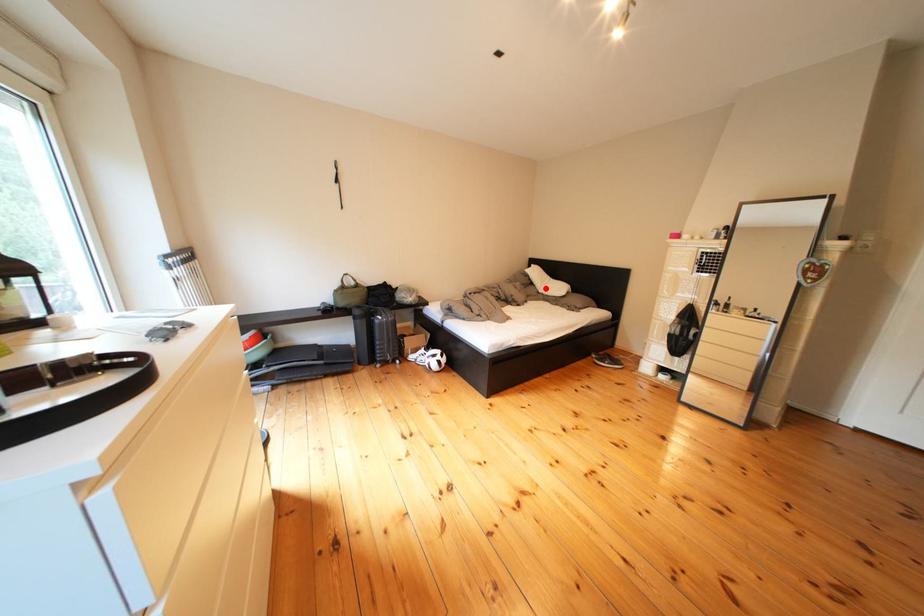
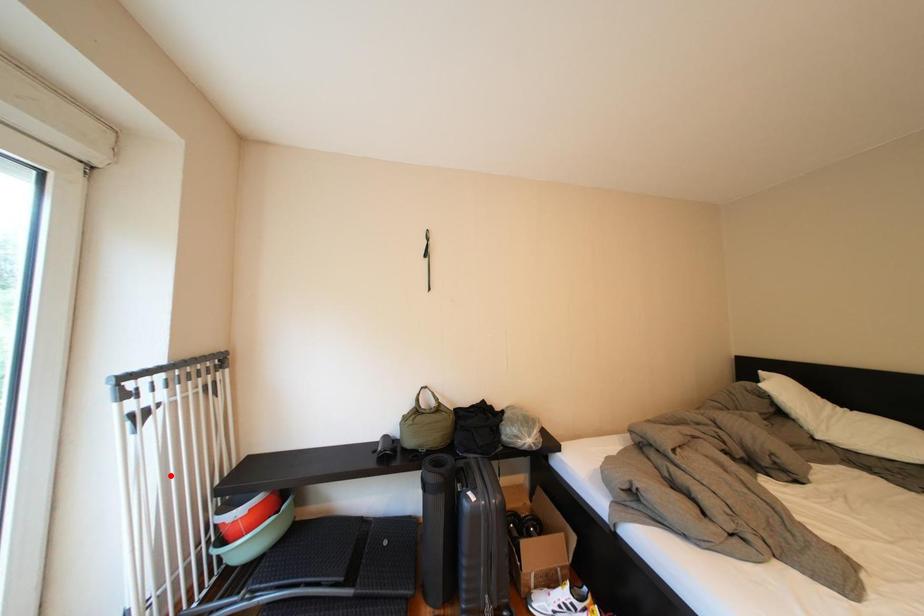
I am providing you with two images of the same scene from different viewpoints. A red point is marked on the first image and another point is marked on the second image. Are the points marked in image1 and image2 representing the same 3D position?

No